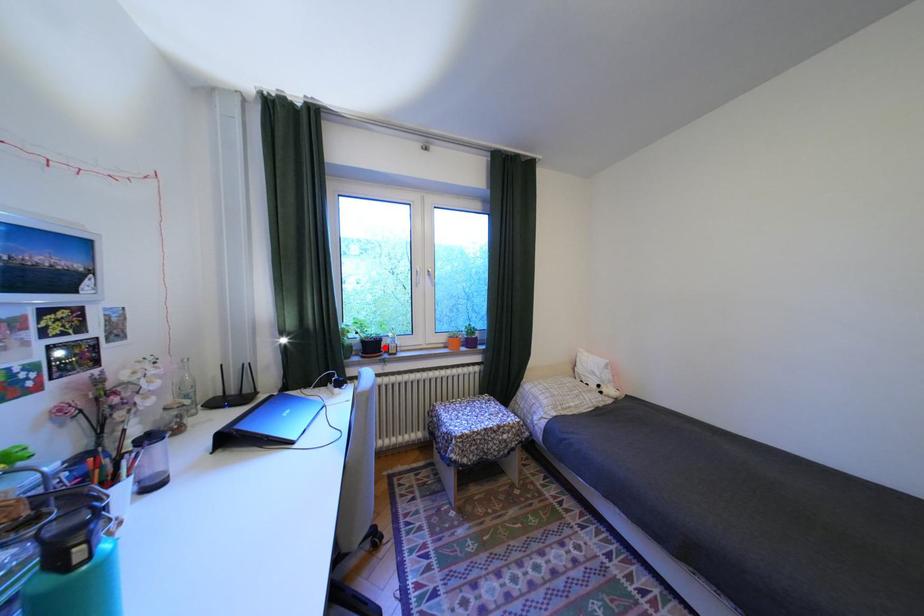
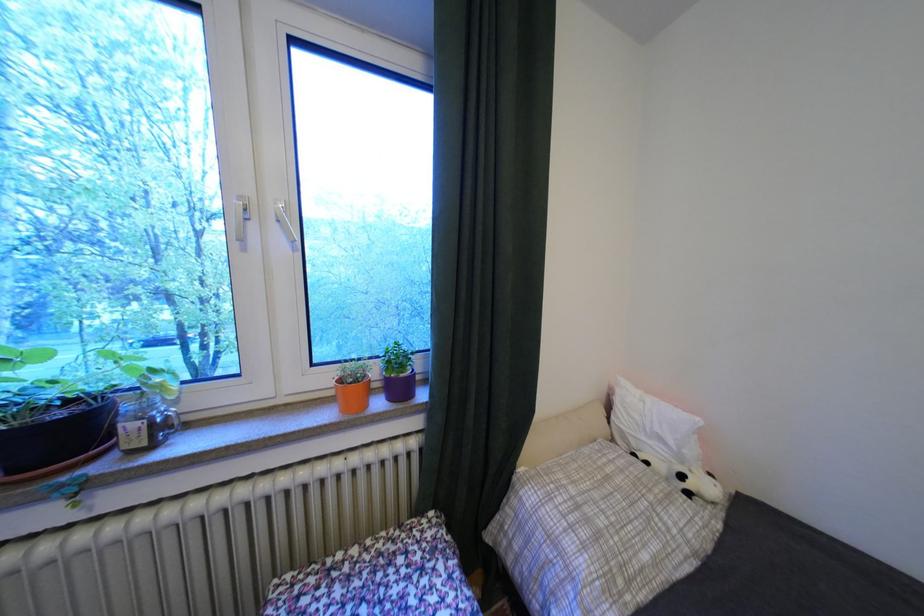
Locate, in the second image, the point that corresponds to the highlighted location in the first image.

(75, 436)